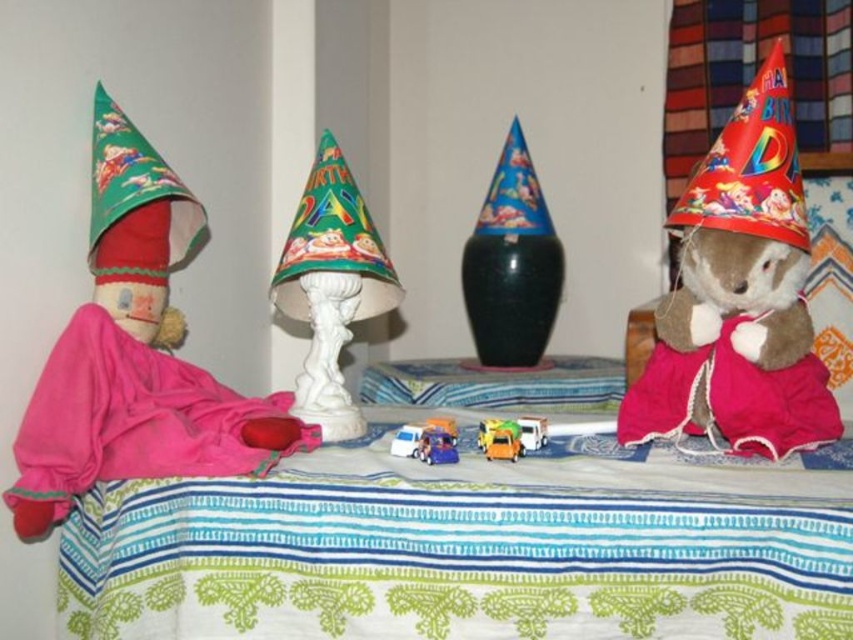
Question: Which point is farther from the camera taking this photo?

Choices:
 (A) (405, 435)
 (B) (808, 342)
 (C) (538, 225)
 (D) (514, 445)

Answer: (C)

Question: Is matte pink fabric doll at left above white plastic toy truck at center?

Choices:
 (A) no
 (B) yes

Answer: (B)

Question: Based on their relative distances, which object is nearer to the green fabric party hat at left?

Choices:
 (A) green paper party hat at center
 (B) metallic yellow truck at center

Answer: (A)

Question: Does fuzzy brown teddy bear at right appear under blue glossy vase at center?

Choices:
 (A) yes
 (B) no

Answer: (A)

Question: Which point is farther to the camera?

Choices:
 (A) (497, 243)
 (B) (422, 432)
 (C) (546, 429)
 (D) (123, 221)

Answer: (A)

Question: Is green paper party hat at center positioned before metallic yellow truck at center?

Choices:
 (A) no
 (B) yes

Answer: (A)